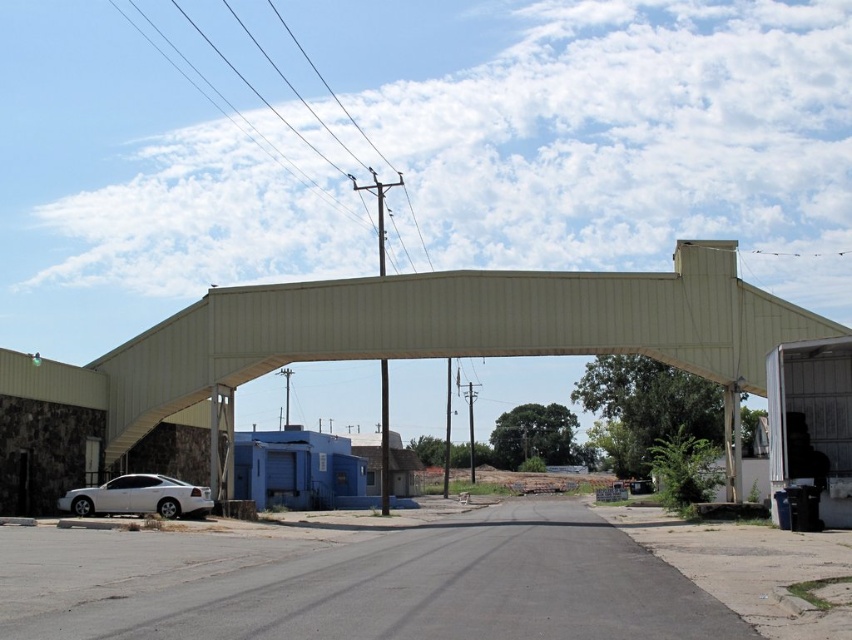
Question: Is metallic roof at center smaller than white glossy sedan at lower left?

Choices:
 (A) yes
 (B) no

Answer: (B)

Question: Among these objects, which one is farthest from the camera?

Choices:
 (A) metallic roof at center
 (B) white glossy sedan at lower left

Answer: (B)

Question: From the image, what is the correct spatial relationship of metallic roof at center in relation to white glossy sedan at lower left?

Choices:
 (A) right
 (B) left

Answer: (A)

Question: Can you confirm if metallic roof at center is positioned above white glossy sedan at lower left?

Choices:
 (A) no
 (B) yes

Answer: (B)

Question: Which point appears farthest from the camera in this image?

Choices:
 (A) (128, 480)
 (B) (142, 394)

Answer: (B)